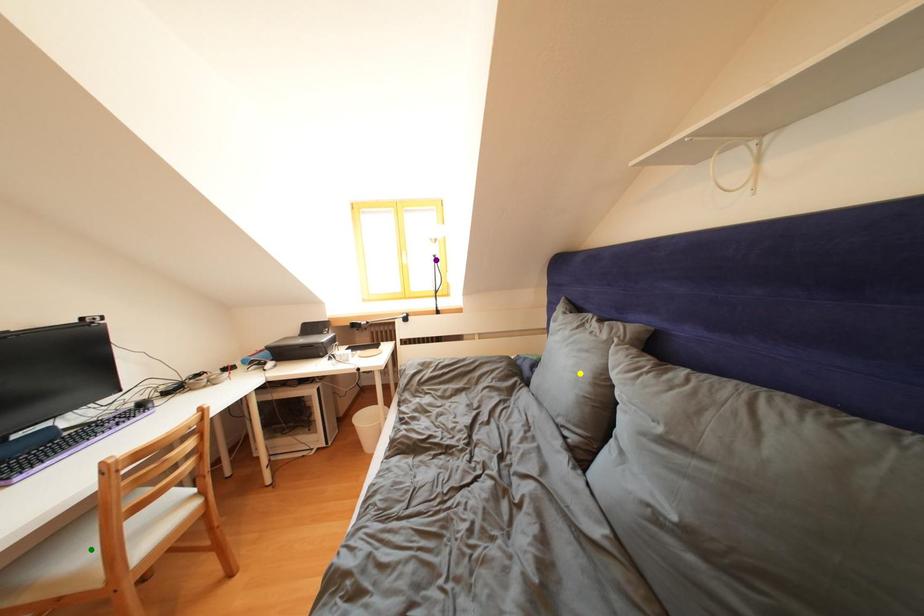
Order these from nearest to farthest:
1. purple point
2. yellow point
3. green point

green point → yellow point → purple point